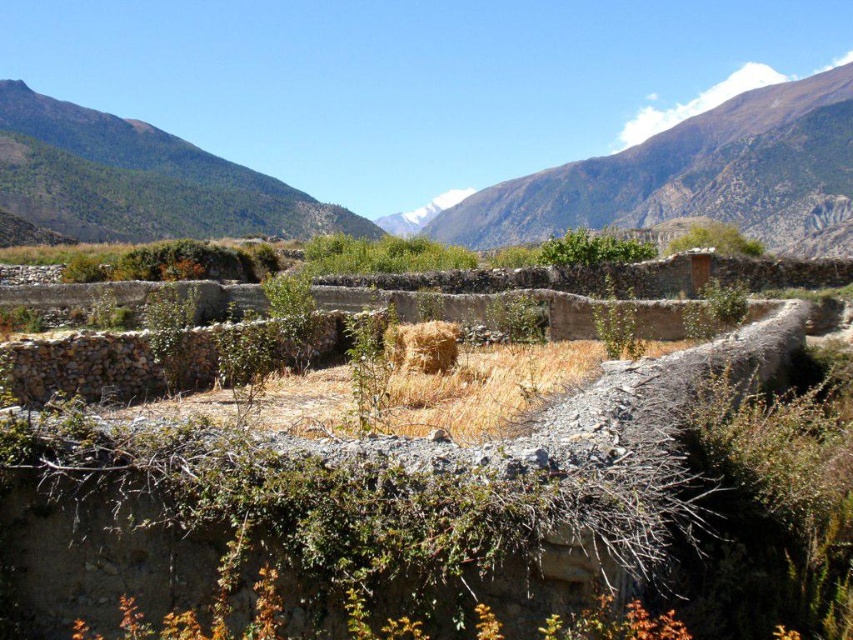
Is snowy rocky mountain at upper right further to camera compared to green textured mountain at left?

Yes, it is behind green textured mountain at left.

Can you confirm if snowy rocky mountain at upper right is shorter than green textured mountain at left?

Incorrect, snowy rocky mountain at upper right's height does not fall short of green textured mountain at left's.

Is point (633, 160) in front of point (26, 150)?

That is False.

This screenshot has width=853, height=640. I want to click on snowy rocky mountain at upper right, so click(x=695, y=177).

Between green textured mountain at left and yellow straw bale at center, which one appears on the left side from the viewer's perspective?

Positioned to the left is green textured mountain at left.

Is green textured mountain at left bigger than yellow straw bale at center?

Indeed, green textured mountain at left has a larger size compared to yellow straw bale at center.

Which is in front, point (202, 163) or point (422, 333)?

Point (422, 333) is more forward.

Locate an element on the screen. Image resolution: width=853 pixels, height=640 pixels. green textured mountain at left is located at coordinates (138, 179).

Who is more distant from viewer, (773, 125) or (448, 346)?

The point (773, 125) is behind.

Is snowy rocky mountain at upper right above yellow straw bale at center?

Correct, snowy rocky mountain at upper right is located above yellow straw bale at center.

Which is behind, point (833, 228) or point (444, 346)?

The point (833, 228) is more distant.

Find the location of a particular element. snowy rocky mountain at upper right is located at coordinates (695, 177).